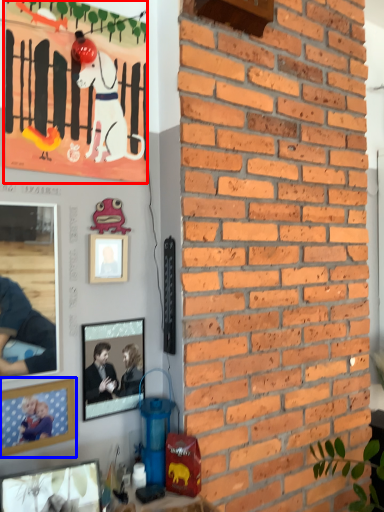
Question: Which object appears closest to the camera in this image, poster (highlighted by a red box) or picture frame (highlighted by a blue box)?

Choices:
 (A) poster
 (B) picture frame

Answer: (B)